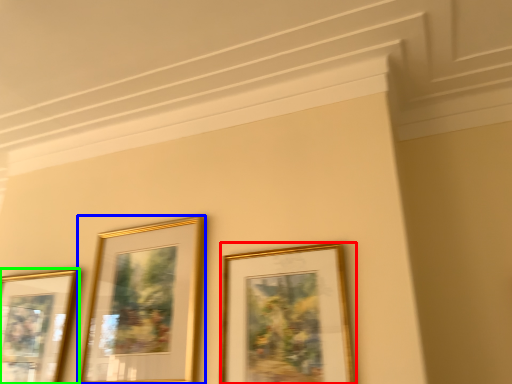
Question: Which is nearer to the picture frame (highlighted by a red box)? picture frame (highlighted by a blue box) or picture frame (highlighted by a green box).

Choices:
 (A) picture frame
 (B) picture frame

Answer: (A)